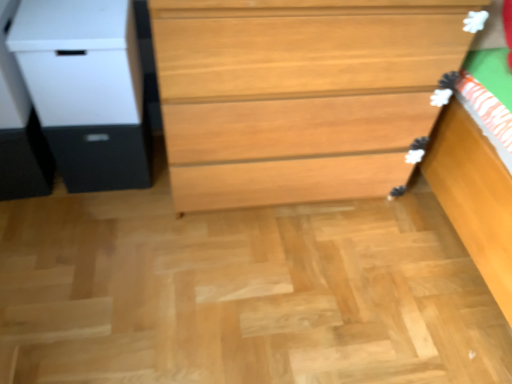
Locate an element on the screen. The image size is (512, 384). light brown wood chest of drawers at center is located at coordinates (298, 94).

At what (x,y) coordinates should I click in order to perform the action: click on light brown wood chest of drawers at center. Please return your answer as a coordinate pair (x, y). Image resolution: width=512 pixels, height=384 pixels. Looking at the image, I should click on (298, 94).

Would you say white matte file cabinet at left is to the left or to the right of light brown wood chest of drawers at center in the picture?

Clearly, white matte file cabinet at left is on the left of light brown wood chest of drawers at center in the image.

Where is `file cabinet lying on the left of light brown wood chest of drawers at center`? The height and width of the screenshot is (384, 512). file cabinet lying on the left of light brown wood chest of drawers at center is located at coordinates (86, 89).

Considering their positions, is white matte file cabinet at left located in front of or behind light brown wood chest of drawers at center?

white matte file cabinet at left is positioned farther from the viewer than light brown wood chest of drawers at center.

Is light brown wood chest of drawers at center oriented towards white matte file cabinet at left?

No, light brown wood chest of drawers at center is not aimed at white matte file cabinet at left.

Is light brown wood chest of drawers at center completely or partially outside of white matte file cabinet at left?

Yes, light brown wood chest of drawers at center is located beyond the bounds of white matte file cabinet at left.

How many degrees apart are the facing directions of light brown wood chest of drawers at center and white matte file cabinet at left?

There is a 0.16-degree angle between the facing directions of light brown wood chest of drawers at center and white matte file cabinet at left.

From the image's perspective, who appears lower, light brown wood chest of drawers at center or white matte file cabinet at left?

From the image's view, light brown wood chest of drawers at center is below.

From a real-world perspective, who is located lower, matte black drawer at left or light brown wood chest of drawers at center?

matte black drawer at left, from a real-world perspective.

Which object is more forward, matte black drawer at left or light brown wood chest of drawers at center?

light brown wood chest of drawers at center is closer to the camera.

Do you think matte black drawer at left is within light brown wood chest of drawers at center, or outside of it?

matte black drawer at left is spatially situated outside light brown wood chest of drawers at center.

Measure the distance between matte black drawer at left and light brown wood chest of drawers at center.

matte black drawer at left is 18.61 inches away from light brown wood chest of drawers at center.

Measure the distance from matte black drawer at left to white matte file cabinet at left.

A distance of 7.56 centimeters exists between matte black drawer at left and white matte file cabinet at left.

In terms of size, does matte black drawer at left appear bigger or smaller than white matte file cabinet at left?

matte black drawer at left is smaller than white matte file cabinet at left.

Consider the image. Is matte black drawer at left positioned far away from white matte file cabinet at left?

No.

Considering the relative sizes of matte black drawer at left and white matte file cabinet at left in the image provided, is matte black drawer at left taller than white matte file cabinet at left?

No, matte black drawer at left is not taller than white matte file cabinet at left.

Is point (191, 170) farther from viewer compared to point (86, 133)?

No, it is not.

Looking at this image, considering the relative sizes of light brown wood chest of drawers at center and matte black drawer at left in the image provided, is light brown wood chest of drawers at center shorter than matte black drawer at left?

Incorrect, the height of light brown wood chest of drawers at center does not fall short of that of matte black drawer at left.

From a real-world perspective, is light brown wood chest of drawers at center positioned above or below matte black drawer at left?

light brown wood chest of drawers at center is situated higher than matte black drawer at left in the real world.

Which is behind, light brown wood chest of drawers at center or matte black drawer at left?

matte black drawer at left is behind.

Who is more distant, white matte file cabinet at left or matte black drawer at left?

matte black drawer at left is further away from the camera.

This screenshot has height=384, width=512. Identify the location of file cabinet that is on the right side of matte black drawer at left. (86, 89).

Between white matte file cabinet at left and matte black drawer at left, which one appears on the right side from the viewer's perspective?

white matte file cabinet at left.

This screenshot has height=384, width=512. Find the location of `file cabinet above the light brown wood chest of drawers at center (from the image's perspective)`. file cabinet above the light brown wood chest of drawers at center (from the image's perspective) is located at coordinates (86, 89).

You are a GUI agent. You are given a task and a screenshot of the screen. Output one action in this format:
    pyautogui.click(x=<x>, y=<y>)
    Task: Click on the file cabinet on the left of light brown wood chest of drawers at center
    The height and width of the screenshot is (384, 512).
    Given the screenshot: What is the action you would take?
    pyautogui.click(x=86, y=89)

Estimate the real-world distances between objects in this image. Which object is further from white matte file cabinet at left, matte black drawer at left or light brown wood chest of drawers at center?

The object further to white matte file cabinet at left is light brown wood chest of drawers at center.

When comparing their distances from matte black drawer at left, does light brown wood chest of drawers at center or white matte file cabinet at left seem closer?

white matte file cabinet at left is closer to matte black drawer at left.

When comparing their distances from light brown wood chest of drawers at center, does matte black drawer at left or white matte file cabinet at left seem further?

matte black drawer at left is positioned further to the anchor light brown wood chest of drawers at center.

Considering their positions, is white matte file cabinet at left positioned further to light brown wood chest of drawers at center than matte black drawer at left?

The object further to light brown wood chest of drawers at center is matte black drawer at left.

When comparing their distances from matte black drawer at left, does white matte file cabinet at left or light brown wood chest of drawers at center seem further?

light brown wood chest of drawers at center.

Estimate the real-world distances between objects in this image. Which object is further from white matte file cabinet at left, light brown wood chest of drawers at center or matte black drawer at left?

light brown wood chest of drawers at center is further to white matte file cabinet at left.

This screenshot has height=384, width=512. Identify the location of file cabinet between matte black drawer at left and light brown wood chest of drawers at center from left to right. (86, 89).